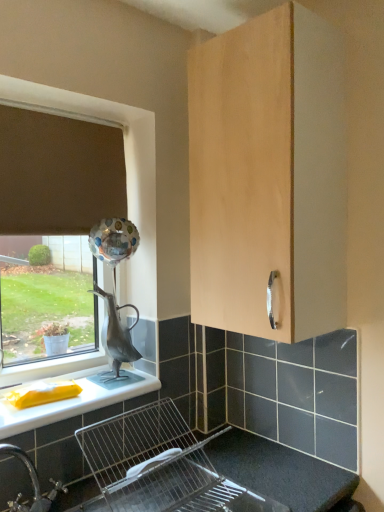
Question: Is the depth of brown fabric curtain at upper left less than that of metallic silver sink at lower center?

Choices:
 (A) yes
 (B) no

Answer: (B)

Question: Is brown fabric curtain at upper left facing towards metallic silver sink at lower center?

Choices:
 (A) no
 (B) yes

Answer: (A)

Question: Is the position of brown fabric curtain at upper left more distant than that of metallic silver sink at lower center?

Choices:
 (A) no
 (B) yes

Answer: (B)

Question: From a real-world perspective, is brown fabric curtain at upper left physically above metallic silver sink at lower center?

Choices:
 (A) yes
 (B) no

Answer: (A)

Question: Is brown fabric curtain at upper left at the left side of metallic silver sink at lower center?

Choices:
 (A) no
 (B) yes

Answer: (B)

Question: Based on their sizes in the image, would you say white glossy countertop at lower left is bigger or smaller than metallic silver sink at lower center?

Choices:
 (A) small
 (B) big

Answer: (A)

Question: Is white glossy countertop at lower left to the left or to the right of metallic silver sink at lower center in the image?

Choices:
 (A) left
 (B) right

Answer: (A)

Question: Looking at their shapes, would you say white glossy countertop at lower left is wider or thinner than metallic silver sink at lower center?

Choices:
 (A) wide
 (B) thin

Answer: (B)

Question: From a real-world perspective, relative to metallic silver sink at lower center, is white glossy countertop at lower left vertically above or below?

Choices:
 (A) below
 (B) above

Answer: (B)

Question: Based on their positions, is brown fabric curtain at upper left located to the left or right of white glossy countertop at lower left?

Choices:
 (A) left
 (B) right

Answer: (A)

Question: In the image, is brown fabric curtain at upper left positioned in front of or behind white glossy countertop at lower left?

Choices:
 (A) behind
 (B) front

Answer: (A)

Question: Would you say brown fabric curtain at upper left is inside or outside white glossy countertop at lower left?

Choices:
 (A) outside
 (B) inside

Answer: (A)

Question: In terms of size, does brown fabric curtain at upper left appear bigger or smaller than white glossy countertop at lower left?

Choices:
 (A) big
 (B) small

Answer: (B)

Question: From a real-world perspective, relative to metallic silver sink at lower center, is light wood cabinet at upper center vertically above or below?

Choices:
 (A) below
 (B) above

Answer: (B)

Question: Considering their positions, is light wood cabinet at upper center located in front of or behind metallic silver sink at lower center?

Choices:
 (A) front
 (B) behind

Answer: (B)